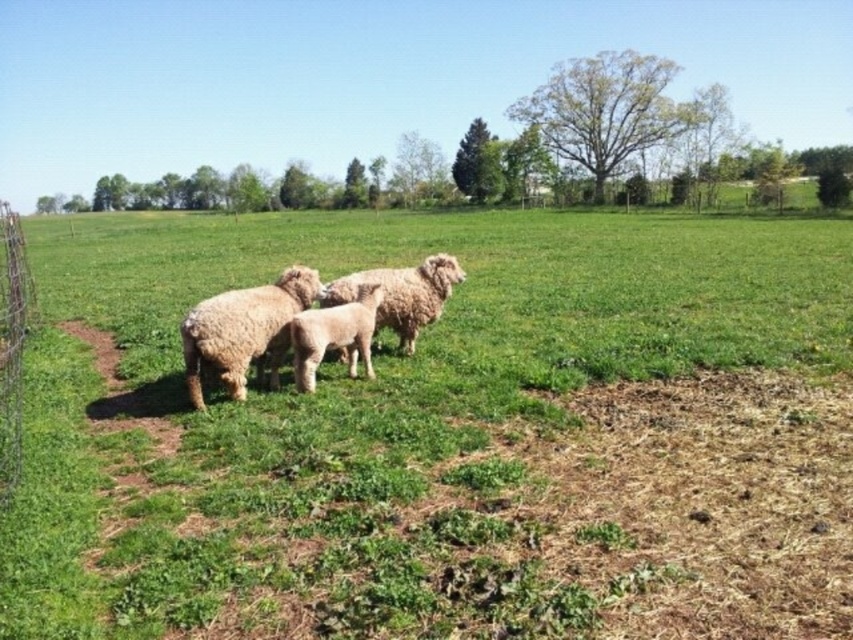
You are a farmer checking the pasture from the fence. You see the fuzzy beige sheep at center and the wire mesh fence at left. Which one is taller?

The fuzzy beige sheep at center has a lesser height compared to the wire mesh fence at left, so the wire mesh fence at left is taller.

You are a farmer checking the health of your sheep. You notice two fuzzy sheep at the center of the pasture. Which one is taller between the fuzzy beige sheep at center and the fuzzy woolen sheep at center?

The fuzzy beige sheep at center is much taller than the fuzzy woolen sheep at center.

You are standing in the middle of the field and see the fuzzy beige sheep at center. What are their coordinates?

The fuzzy beige sheep at center are located at coordinates point (244,330).